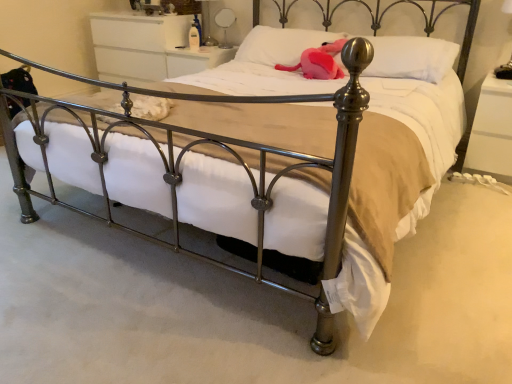
Question: Is metallic silver table lamp at upper center, the 2th table lamp in the bottom-to-top sequence, further to camera compared to metallic silver table lamp at upper right, positioned as the first table lamp in front-to-back order?

Choices:
 (A) yes
 (B) no

Answer: (A)

Question: Is metallic silver table lamp at upper center, positioned as the 2th table lamp in right-to-left order, far from metallic silver table lamp at upper right, which is the 1th table lamp in right-to-left order?

Choices:
 (A) no
 (B) yes

Answer: (B)

Question: Considering the relative sizes of metallic silver table lamp at upper center, which is the first table lamp in back-to-front order, and metallic silver table lamp at upper right, marked as the second table lamp in a back-to-front arrangement, in the image provided, is metallic silver table lamp at upper center, which is the first table lamp in back-to-front order, shorter than metallic silver table lamp at upper right, marked as the second table lamp in a back-to-front arrangement,?

Choices:
 (A) yes
 (B) no

Answer: (A)

Question: Does metallic silver table lamp at upper center, the 2th table lamp in the bottom-to-top sequence, appear on the left side of metallic silver table lamp at upper right, which ranks as the first table lamp in bottom-to-top order?

Choices:
 (A) no
 (B) yes

Answer: (B)

Question: Is metallic silver table lamp at upper center, positioned as the 2th table lamp in right-to-left order, closer to camera compared to metallic silver table lamp at upper right, which ranks as the first table lamp in bottom-to-top order?

Choices:
 (A) no
 (B) yes

Answer: (A)

Question: Is point (320, 59) closer or farther from the camera than point (206, 0)?

Choices:
 (A) closer
 (B) farther

Answer: (A)

Question: Would you say pink plush toy at center is inside or outside metallic silver table lamp at upper center, which is the first table lamp in back-to-front order?

Choices:
 (A) inside
 (B) outside

Answer: (B)

Question: Considering the positions of pink plush toy at center and metallic silver table lamp at upper center, which is the first table lamp in back-to-front order, in the image, is pink plush toy at center bigger or smaller than metallic silver table lamp at upper center, which is the first table lamp in back-to-front order,?

Choices:
 (A) big
 (B) small

Answer: (A)

Question: From the image's perspective, is pink plush toy at center located above or below metallic silver table lamp at upper center, which is the first table lamp in back-to-front order?

Choices:
 (A) below
 (B) above

Answer: (A)

Question: From the image's perspective, relative to white soft pillow at upper center, which is counted as the second pillow, starting from the left, is white glossy nightstand at right, the first nightstand positioned from the front, above or below?

Choices:
 (A) above
 (B) below

Answer: (B)

Question: Considering the positions of white glossy nightstand at right, the 2th nightstand positioned from the left, and white soft pillow at upper center, the 1th pillow from the right, in the image, is white glossy nightstand at right, the 2th nightstand positioned from the left, taller or shorter than white soft pillow at upper center, the 1th pillow from the right,?

Choices:
 (A) short
 (B) tall

Answer: (B)

Question: Considering the positions of white glossy nightstand at right, acting as the 2th nightstand starting from the top, and white soft pillow at upper center, which is counted as the second pillow, starting from the left, in the image, is white glossy nightstand at right, acting as the 2th nightstand starting from the top, bigger or smaller than white soft pillow at upper center, which is counted as the second pillow, starting from the left,?

Choices:
 (A) big
 (B) small

Answer: (A)

Question: Do you think white glossy nightstand at right, the 2th nightstand positioned from the left, is within white soft pillow at upper center, which is counted as the second pillow, starting from the left, or outside of it?

Choices:
 (A) outside
 (B) inside

Answer: (A)

Question: Is white glossy dresser at upper center, positioned as the 1th nightstand in back-to-front order, bigger or smaller than pink plush toy at center?

Choices:
 (A) small
 (B) big

Answer: (B)

Question: From a real-world perspective, is white glossy dresser at upper center, which is the 2th nightstand from right to left, positioned above or below pink plush toy at center?

Choices:
 (A) below
 (B) above

Answer: (A)